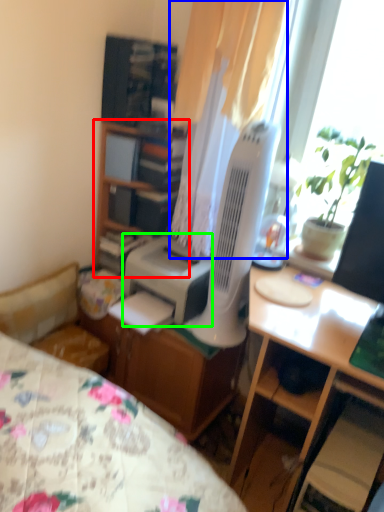
Question: Which is farther away from cabinetry (highlighted by a red box)? curtain (highlighted by a blue box) or printer (highlighted by a green box)?

Choices:
 (A) curtain
 (B) printer

Answer: (A)